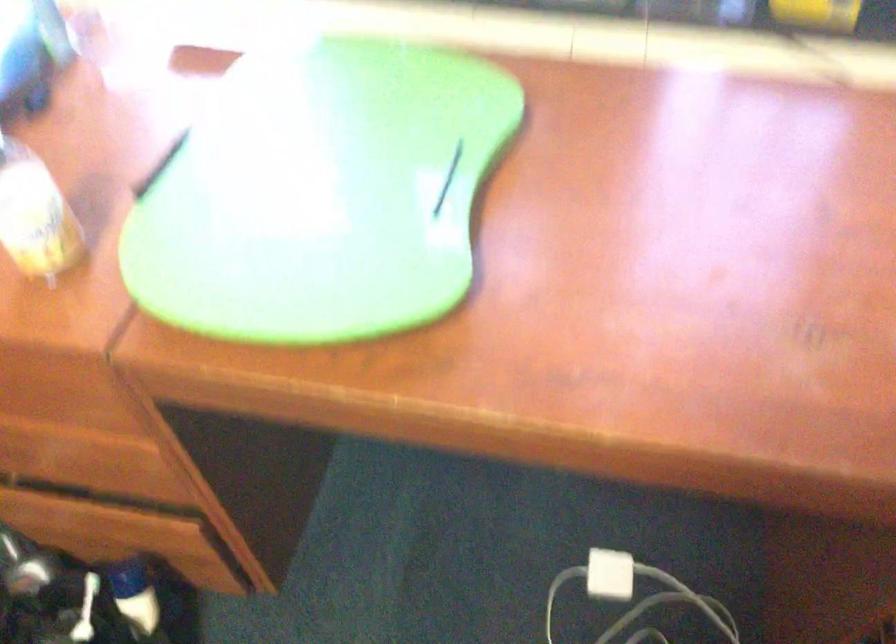
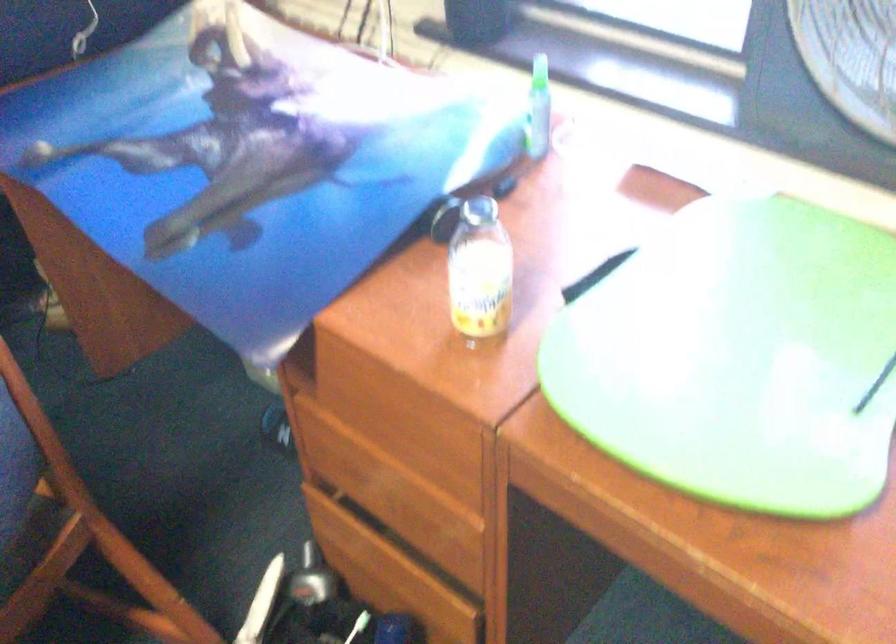
The point at (328, 198) is marked in the first image. Where is the corresponding point in the second image?

(738, 357)